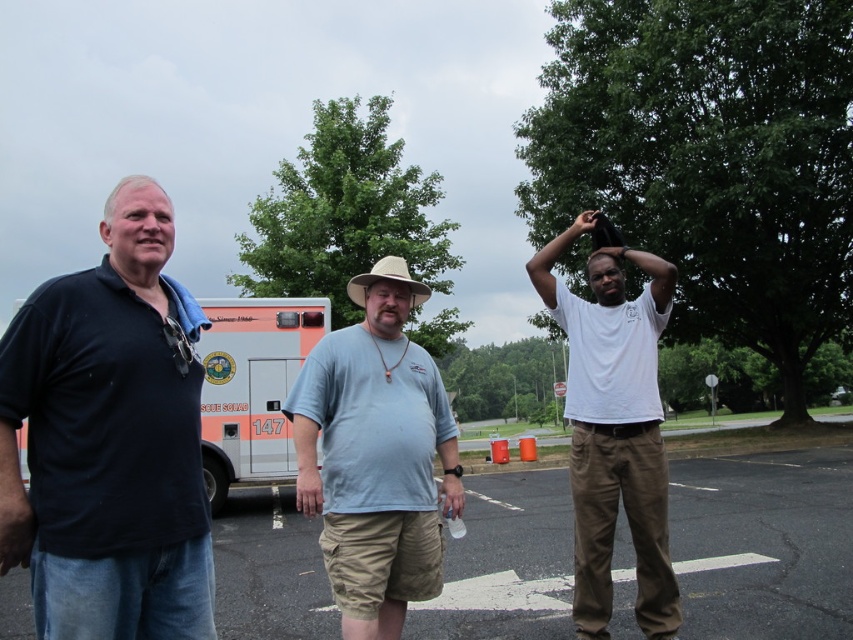
You are a photographer trying to capture a group photo of the dark blue cotton shirt at left and the light blue cotton shirt at center. To ensure both are in focus, you need to know which one is wider. Which one has a larger width?

The light blue cotton shirt at center has a greater width compared to the dark blue cotton shirt at left, so you should adjust the camera settings to accommodate its larger size for better focus.

You are a photographer trying to capture a candid shot of the light blue cotton shirt at center without including the dark blue cotton shirt at left in the frame. Based on their positions, is this possible?

The dark blue cotton shirt at left is in front of the light blue cotton shirt at center, so it would block the view of the light blue cotton shirt at center. Therefore, capturing a clear shot of the light blue cotton shirt at center without the dark blue cotton shirt at left would not be possible unless the photographer moves around the obstruction.

You are standing at the point labeled point (x=20, y=324) and want to walk to the point labeled point (x=416, y=484). According to the scene description, will you have to walk towards the background or the foreground?

Since point (x=20, y=324) is in front of point (x=416, y=484), you will need to walk towards the background to reach point (x=416, y=484) from your current position.